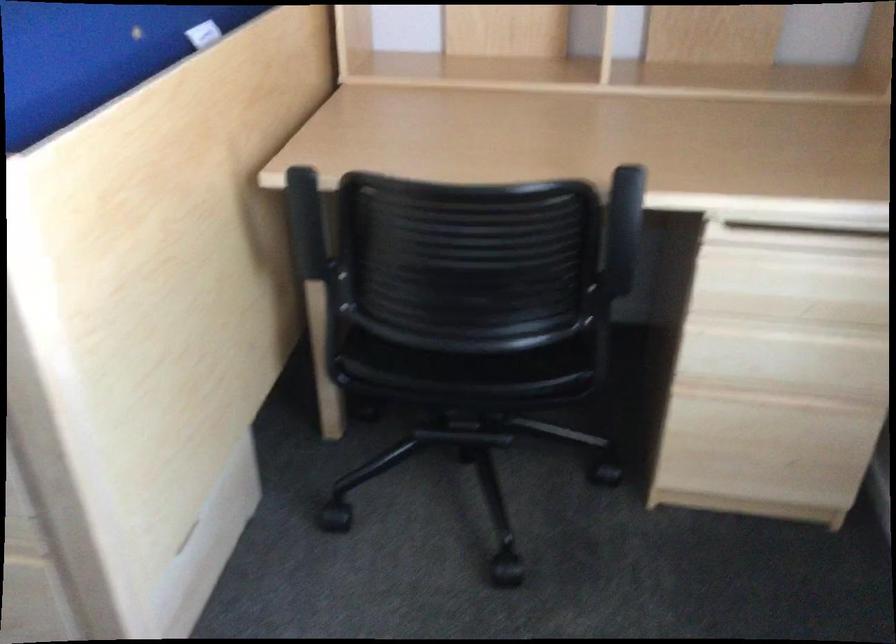
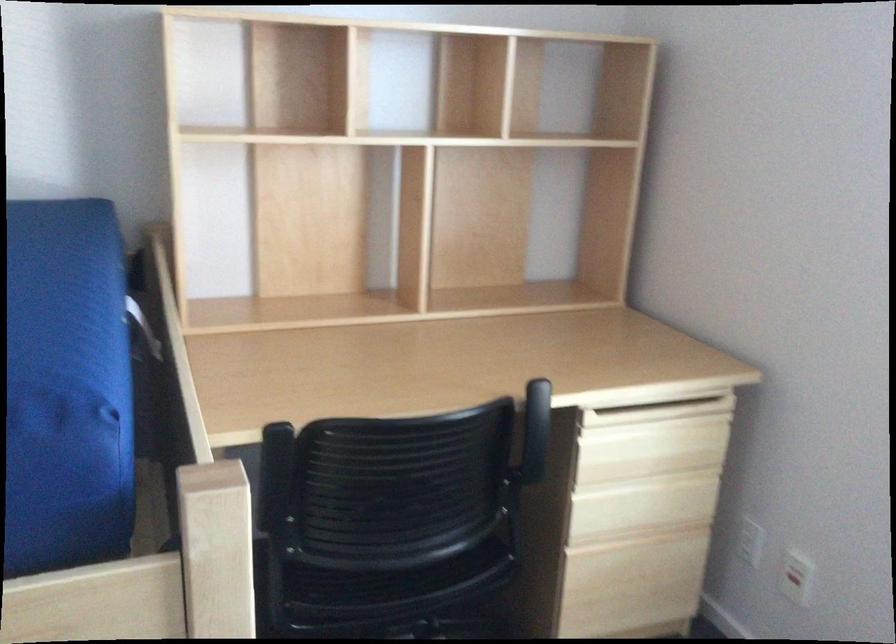
Where in the second image is the point corresponding to point (619, 216) from the first image?

(536, 417)